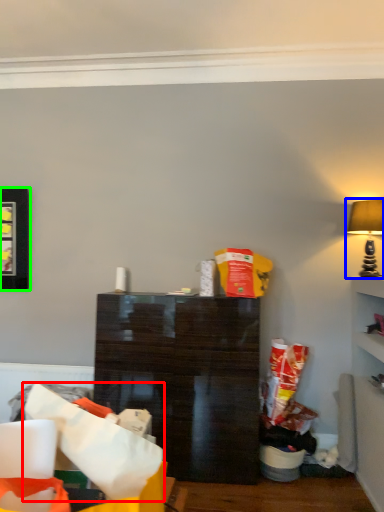
Question: Which is farther away from paper bag (highlighted by a red box)? lamp (highlighted by a blue box) or picture frame (highlighted by a green box)?

Choices:
 (A) lamp
 (B) picture frame

Answer: (B)